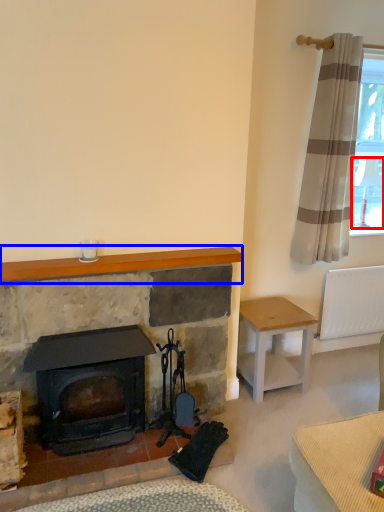
Question: Which point is further to the camera, lamp (highlighted by a red box) or mantle (highlighted by a blue box)?

Choices:
 (A) lamp
 (B) mantle

Answer: (A)